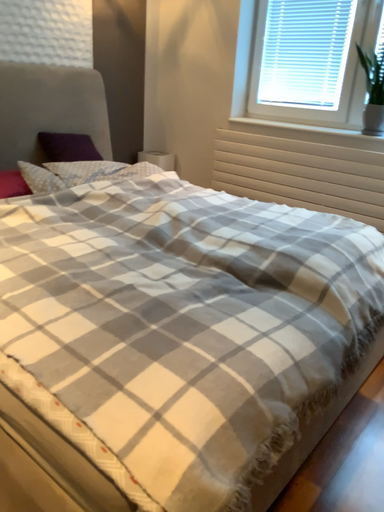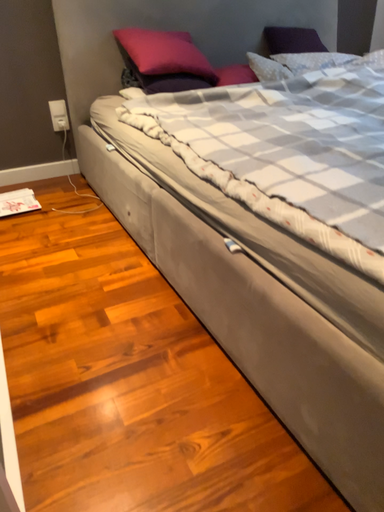
Question: Which way did the camera rotate in the video?

Choices:
 (A) rotated left
 (B) rotated right

Answer: (A)